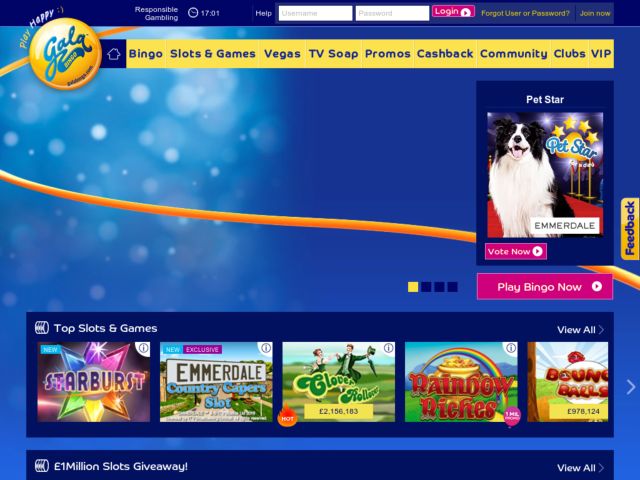
The image size is (640, 480). Identify the location of pink box. (448, 6), (484, 289), (508, 254).